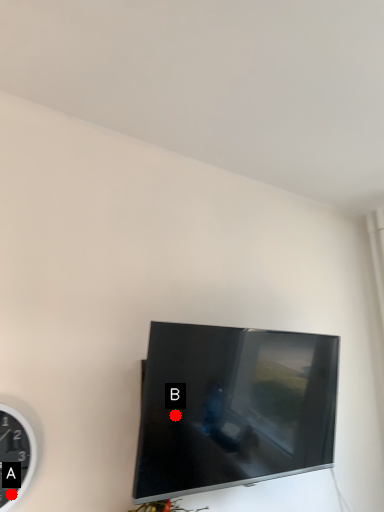
Question: Two points are circled on the image, labeled by A and B beside each circle. Among these points, which one is nearest to the camera?

Choices:
 (A) A is closer
 (B) B is closer

Answer: (A)